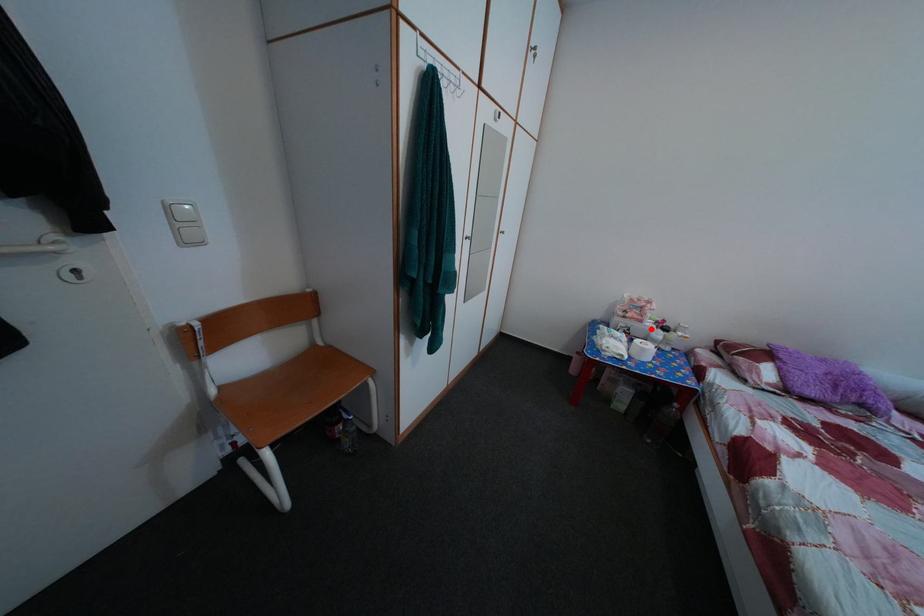
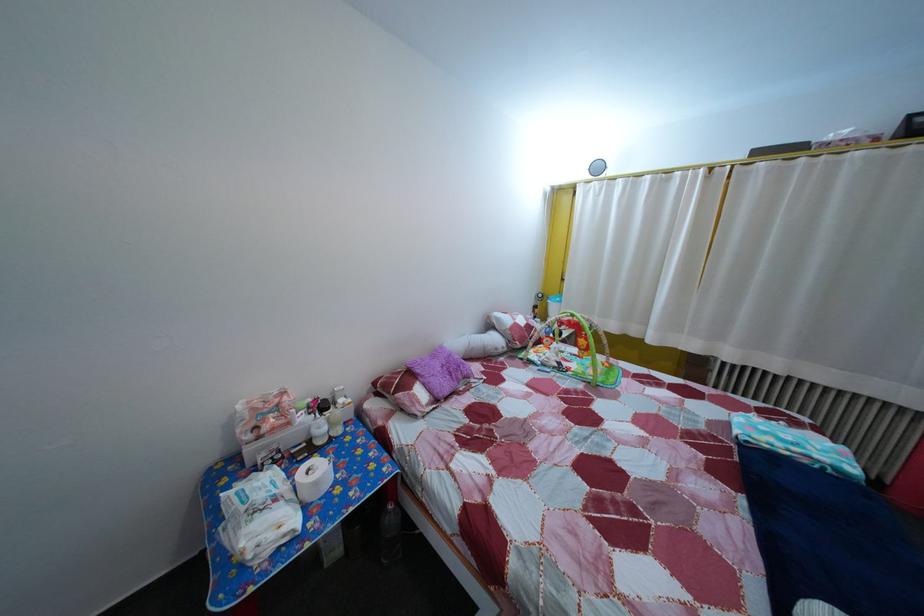
Question: I am providing you with two images of the same scene from different viewpoints. A red point is marked on the first image. At the location where the point appears in image 1, is it still visible in image 2?

Choices:
 (A) Yes
 (B) No

Answer: (A)